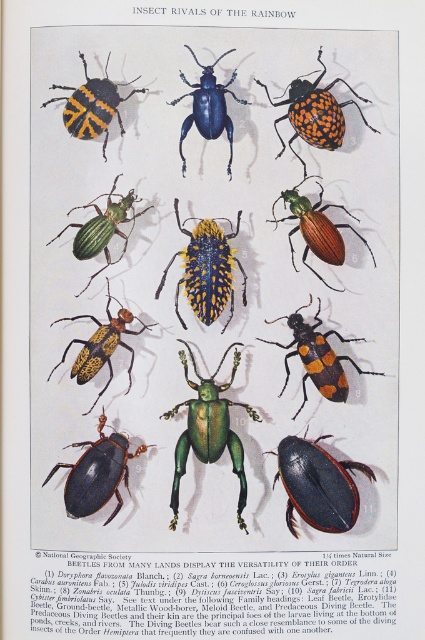
You are an entomologist examining the beetle display. You need to locate the metallic green beetle at center and the glossy blue beetle at center. Which beetle is positioned lower in the arrangement?

The metallic green beetle at center is positioned below the glossy blue beetle at center, so it is lower in the arrangement.

You are an entomologist examining the image of beetles. You need to locate the metallic green beetle at center. What are its coordinates in the image?

The metallic green beetle at center is located at coordinates point [209,595].